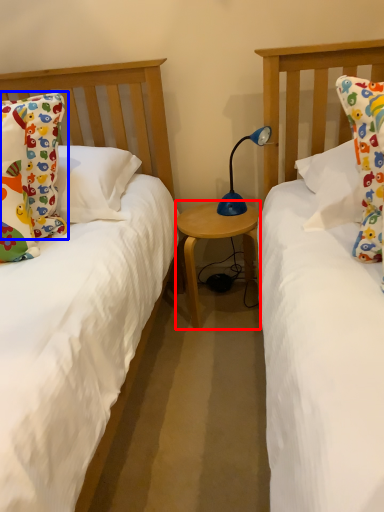
Question: Which of the following is the farthest to the observer, table (highlighted by a red box) or pillow (highlighted by a blue box)?

Choices:
 (A) table
 (B) pillow

Answer: (A)